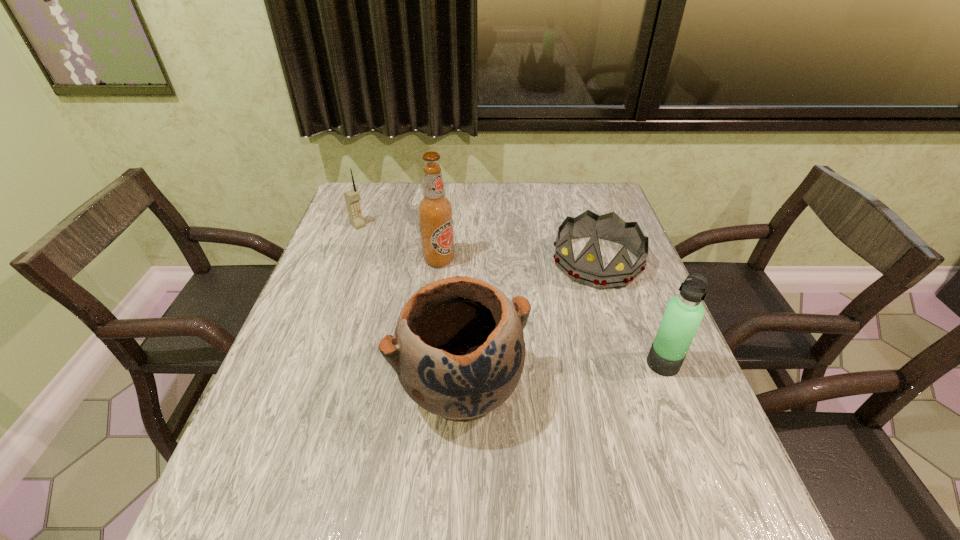
Where is `pottery`? pottery is located at coordinates (458, 350).

Identify the location of thermos bottle. The image size is (960, 540). (683, 315).

Locate an element on the screen. The width and height of the screenshot is (960, 540). the tallest object is located at coordinates (435, 211).

Find the location of a particular element. Image resolution: width=960 pixels, height=540 pixels. the leftmost object is located at coordinates (352, 197).

Locate an element on the screen. The width and height of the screenshot is (960, 540). the farthest object is located at coordinates (352, 197).

At what (x,y) coordinates should I click in order to perform the action: click on tiara. Please return your answer as a coordinate pair (x, y). This screenshot has width=960, height=540. Looking at the image, I should click on (588, 269).

At what (x,y) coordinates should I click in order to perform the action: click on vacant area situated 0.100m on the back of the pottery. Please return your answer as a coordinate pair (x, y). This screenshot has height=540, width=960. Looking at the image, I should click on (464, 309).

The height and width of the screenshot is (540, 960). In order to click on vacant space located 0.210m on the back of the thermos bottle in this screenshot , I will do `click(634, 288)`.

Where is `vacant region located on the front label of the beer bottle`? The image size is (960, 540). vacant region located on the front label of the beer bottle is located at coordinates (533, 353).

The width and height of the screenshot is (960, 540). In order to click on vacant space located 0.140m on the front label of the beer bottle in this screenshot , I will do `click(477, 297)`.